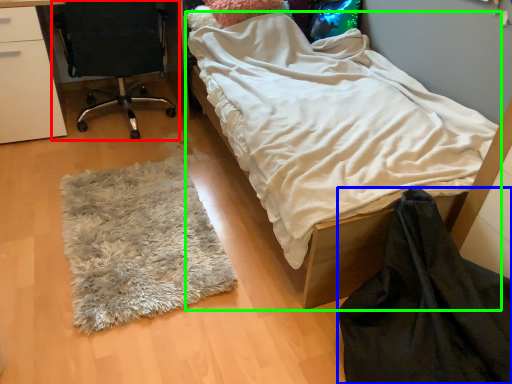
Question: Estimate the real-world distances between objects in this image. Which object is farther from chair (highlighted by a red box), blanket (highlighted by a blue box) or bed (highlighted by a green box)?

Choices:
 (A) blanket
 (B) bed

Answer: (A)